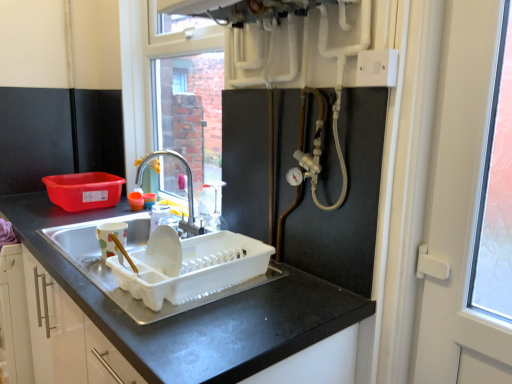
Question: Is point pyautogui.click(x=109, y=253) closer or farther from the camera than point pyautogui.click(x=275, y=349)?

Choices:
 (A) closer
 (B) farther

Answer: (B)

Question: Considering the positions of matte ceramic mug at left, the second appliance when ordered from right to left, and black matte countertop at center in the image, is matte ceramic mug at left, the second appliance when ordered from right to left, taller or shorter than black matte countertop at center?

Choices:
 (A) tall
 (B) short

Answer: (B)

Question: Which of these objects is positioned farthest from the black matte countertop at center?

Choices:
 (A) white plastic screen door at right
 (B) white plastic dish rack at sink, the 1th appliance when ordered from right to left
 (C) brushed metal faucet at center
 (D) white plastic electric outlet at upper right
 (E) matte ceramic mug at left, arranged as the first appliance when viewed from the left

Answer: (C)

Question: Based on their relative distances, which object is nearer to the white plastic dish rack at sink, the 1th appliance when ordered from right to left?

Choices:
 (A) black matte countertop at center
 (B) white plastic screen door at right
 (C) white plastic electric outlet at upper right
 (D) matte ceramic mug at left, arranged as the first appliance when viewed from the left
 (E) brushed metal faucet at center

Answer: (A)